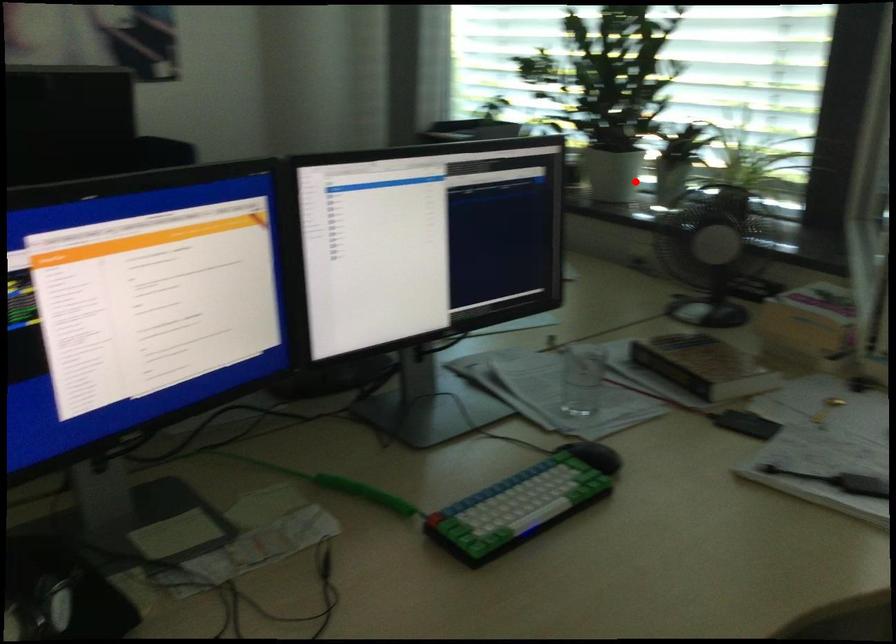
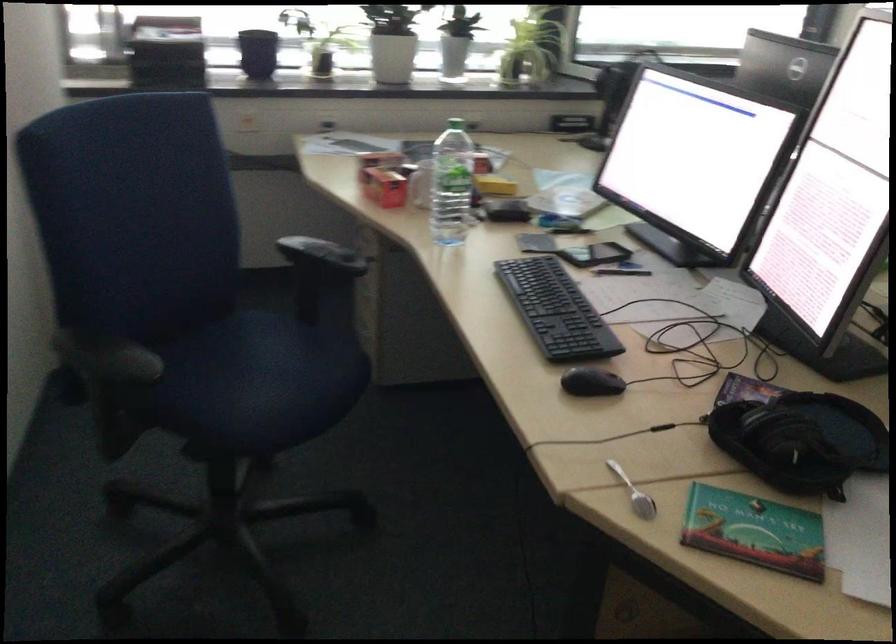
Question: I am providing you with two images of the same scene from different viewpoints. A red point is shown in image1. For the corresponding object point in image2, is it positioned nearer or farther from the camera?

Choices:
 (A) Nearer
 (B) Farther

Answer: (B)